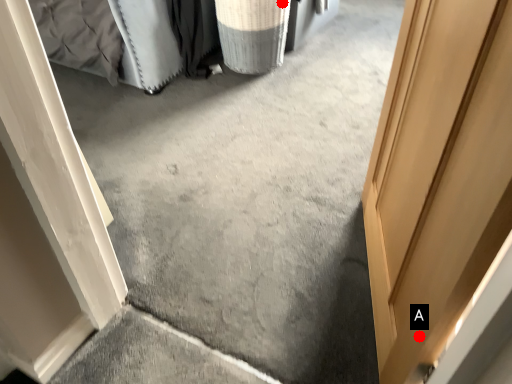
Question: Two points are circled on the image, labeled by A and B beside each circle. Which point is closer to the camera?

Choices:
 (A) A is closer
 (B) B is closer

Answer: (A)